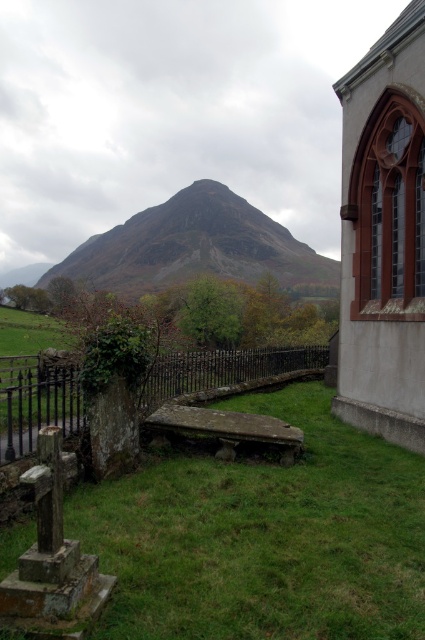
You are a painter planning to sketch the rustic brown mountain at center and the rusty metal fence at center in the scene. Which object should you focus on first if you want to capture the larger one in your painting?

The rustic brown mountain at center is larger than the rusty metal fence at center, so you should focus on the rustic brown mountain at center first.

From the picture: You are a visitor standing in the churchyard and want to take a photo of both the smooth stone church at right and the rusty metal fence at center. Since you want both objects in the frame, which one should you move closer to and why?

You should move closer to the smooth stone church at right because it is smaller in size compared to the rusty metal fence at center. By moving closer to the smaller church, you can ensure both objects fit within the camera frame while maintaining their visibility.